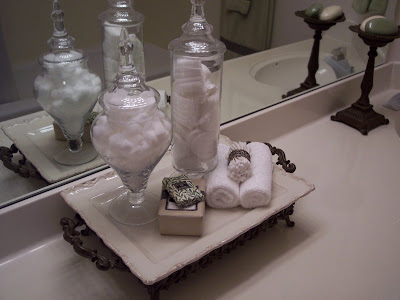
You are a GUI agent. You are given a task and a screenshot of the screen. Output one action in this format:
    pyautogui.click(x=<x>, y=<y>)
    Task: Click on the hand soap stand and trey
    
    Given the screenshot: What is the action you would take?
    pyautogui.click(x=370, y=81)